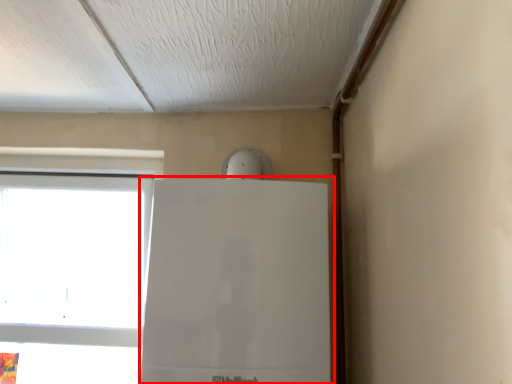
Question: Considering the relative positions of fridge (annotated by the red box) and window in the image provided, where is fridge (annotated by the red box) located with respect to the staircase?

Choices:
 (A) left
 (B) right

Answer: (B)